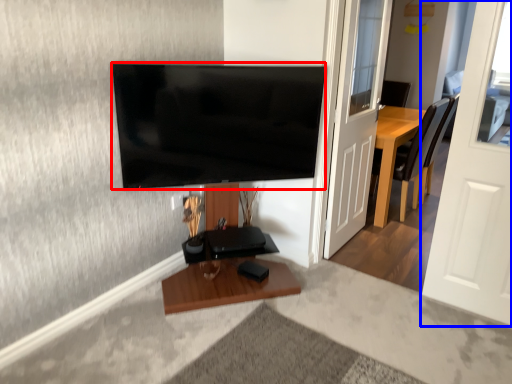
Question: Which object appears farthest to the camera in this image, television (highlighted by a red box) or door (highlighted by a blue box)?

Choices:
 (A) television
 (B) door

Answer: (A)